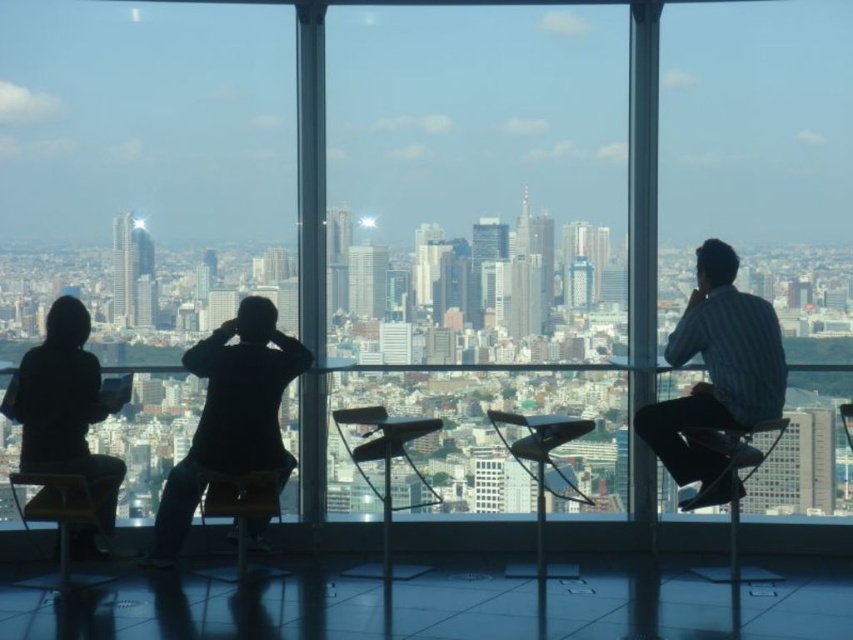
You are a visitor at the observation deck and want to choose a chair that is taller to get a better view. Which chair should you pick between the wooden chair at lower left and the wooden chair at center?

The wooden chair at lower left is taller than the wooden chair at center, so you should pick the wooden chair at lower left to get a better view.

You are an interior designer assessing the space for seating arrangements. You notice the silhouette jacket at left and the wooden chair at center. Which object takes up more space in the scene?

The silhouette jacket at left has a larger size compared to the wooden chair at center, so it takes up more space in the scene.